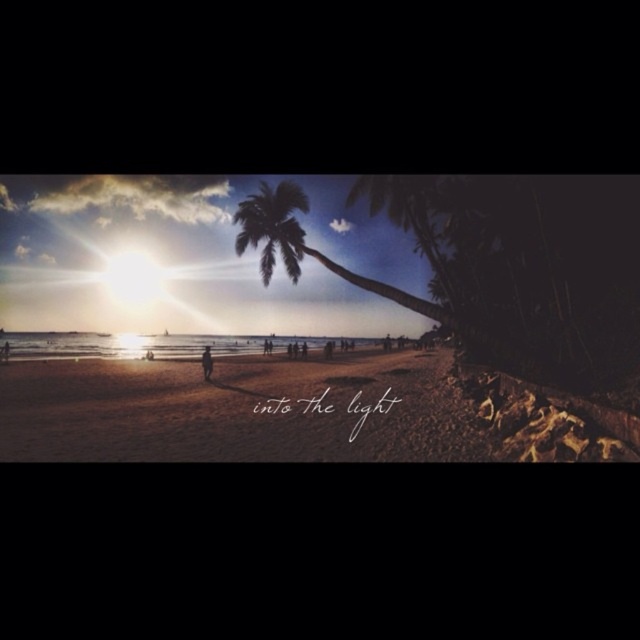
You are standing on the beach facing the ocean. You see a green leafy palm tree at center and a silhouette figure at center. Which object is positioned to the right side of the other?

The green leafy palm tree at center is to the right of the silhouette figure at center.

You are standing on the sandy beach at center and want to walk towards the green leafy palm tree at center. In which direction should you head?

You should head to the right because the sandy beach at center is to the left of the green leafy palm tree at center, so moving right will take you towards it.